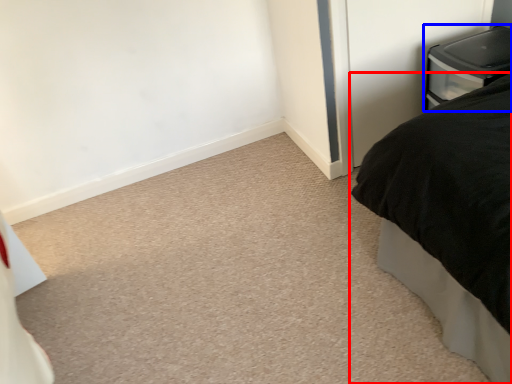
Question: Which point is closer to the camera, bed (highlighted by a red box) or furniture (highlighted by a blue box)?

Choices:
 (A) bed
 (B) furniture

Answer: (A)